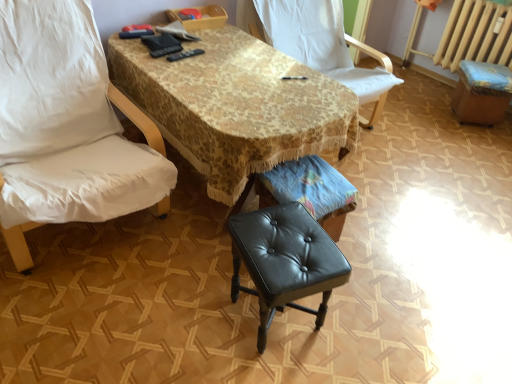
Locate an element on the screen. The image size is (512, 384). free space above gold lace tablecloth at center (from a real-world perspective) is located at coordinates (233, 70).